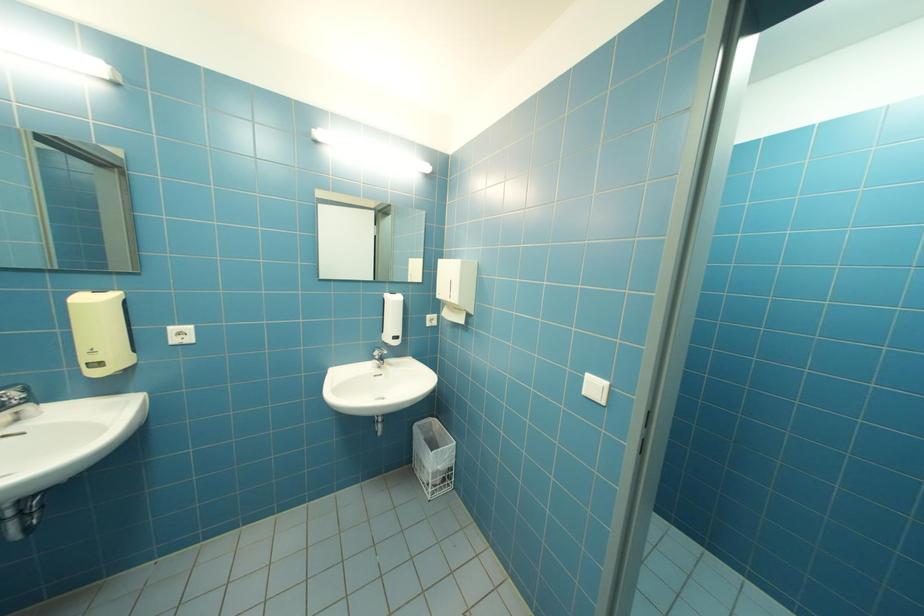
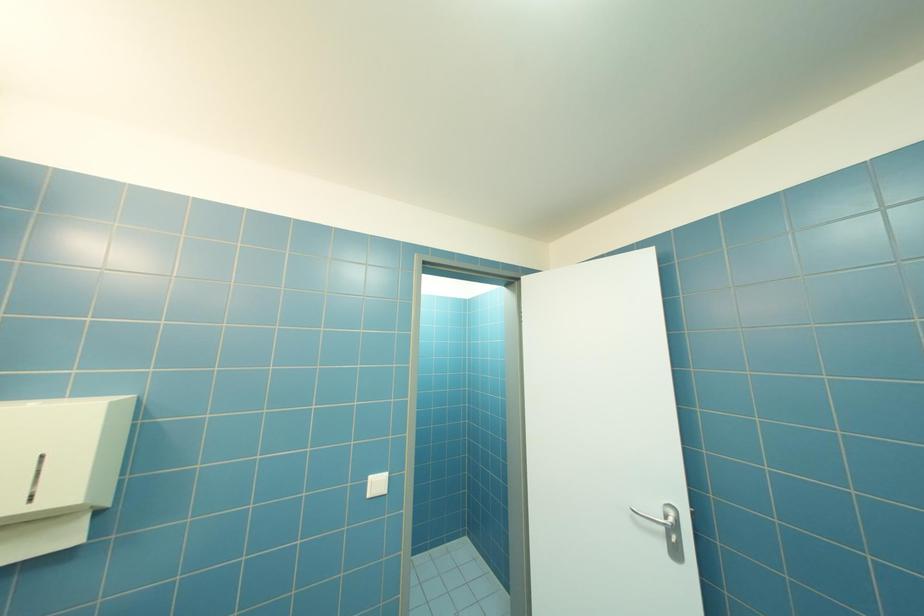
Question: How did the camera likely rotate?

Choices:
 (A) Left
 (B) Right
 (C) Up
 (D) Down

Answer: (B)